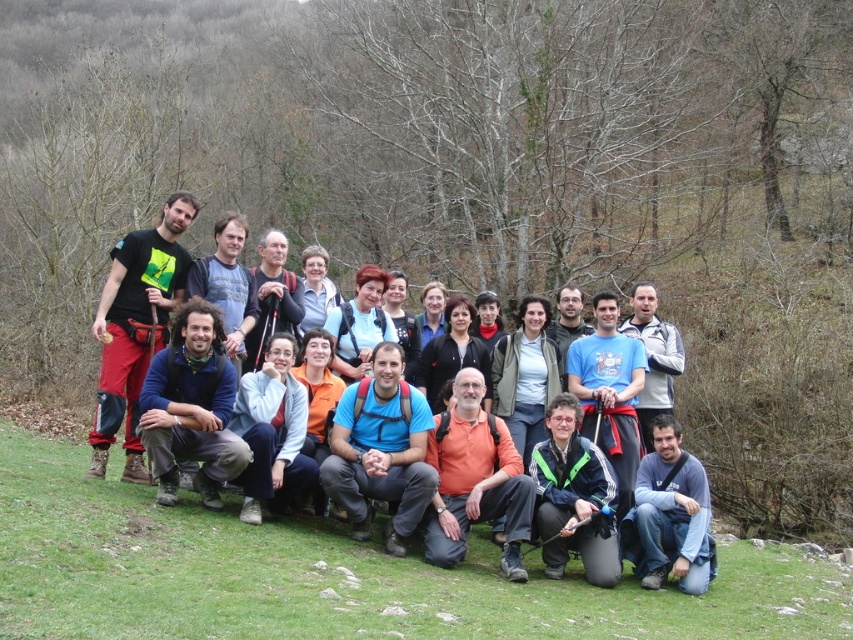
Question: Does matte black backpack at center appear on the left side of dark blue t-shirt at lower right?

Choices:
 (A) no
 (B) yes

Answer: (B)

Question: Among these points, which one is farthest from the camera?

Choices:
 (A) (619, 378)
 (B) (654, 566)

Answer: (A)

Question: Which of the following is the farthest from the observer?

Choices:
 (A) (697, 477)
 (B) (573, 397)

Answer: (B)

Question: Is matte black backpack at center wider than dark blue t-shirt at lower right?

Choices:
 (A) no
 (B) yes

Answer: (A)

Question: Is the position of matte black backpack at center less distant than that of dark blue t-shirt at lower right?

Choices:
 (A) yes
 (B) no

Answer: (B)